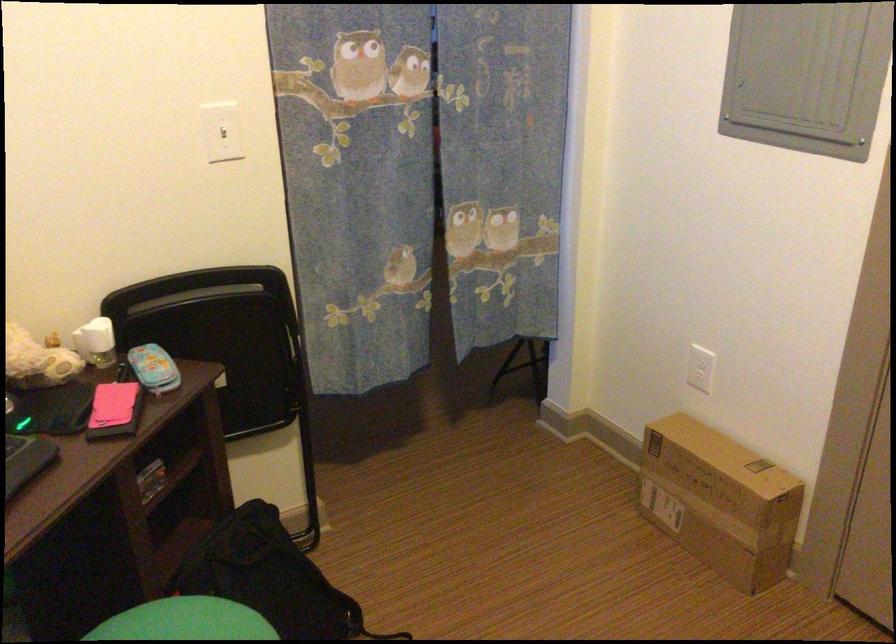
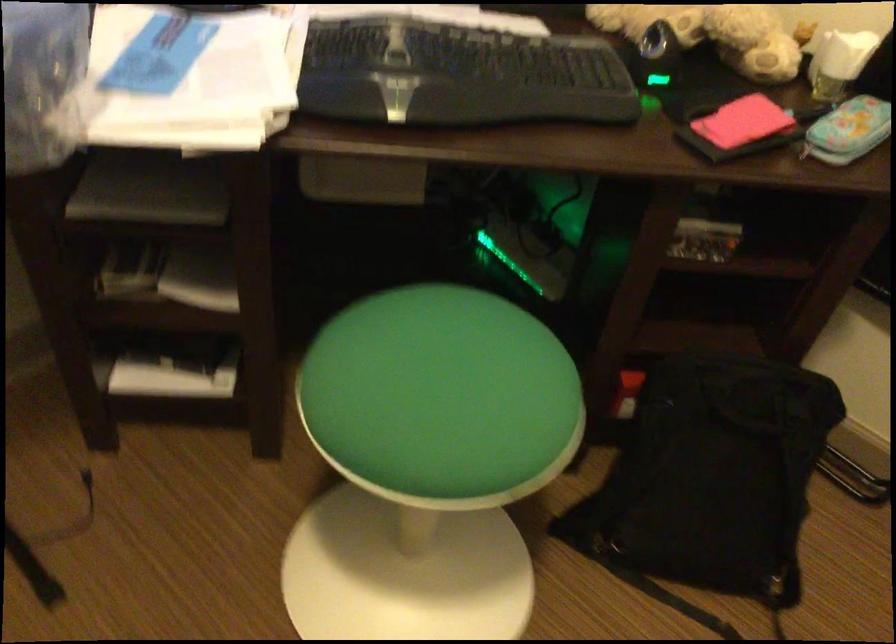
The point at (122, 408) is marked in the first image. Where is the corresponding point in the second image?

(739, 128)